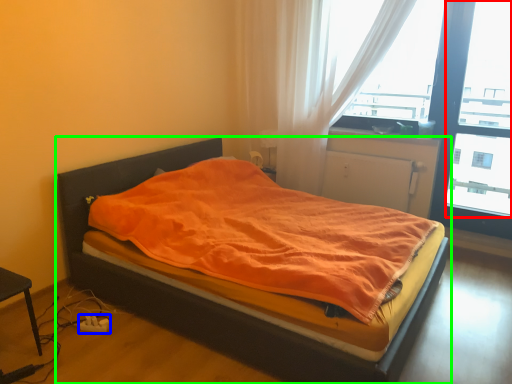
Question: Which object is positioned closest to window screen (highlighted by a red box)? Select from charger (highlighted by a blue box) and bed (highlighted by a green box).

Choices:
 (A) charger
 (B) bed

Answer: (B)